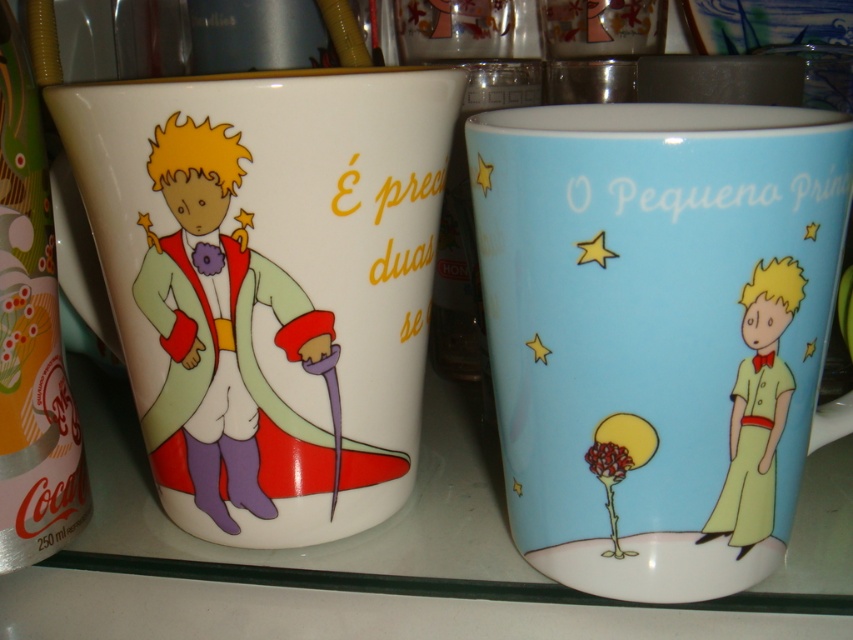
You are arranging these two mugs on a narrow shelf. The white glossy mug at left is wider than the light blue ceramic mug at center. Which mug should you place first to ensure they both fit on the shelf?

You should place the white glossy mug at left first because it is wider than the light blue ceramic mug at center, allowing the narrower mug to fit alongside it.

Based on the photo, you are arranging mugs on a shelf and want to place a new mug between the light blue ceramic mug at center and the white glossy mug at left. Based on their current positions, where should you place the new mug to maintain the existing arrangement?

The light blue ceramic mug at center is below the white glossy mug at left, so to maintain the existing arrangement, place the new mug between them vertically, ensuring it is positioned below the white glossy mug at left and above the light blue ceramic mug at center.